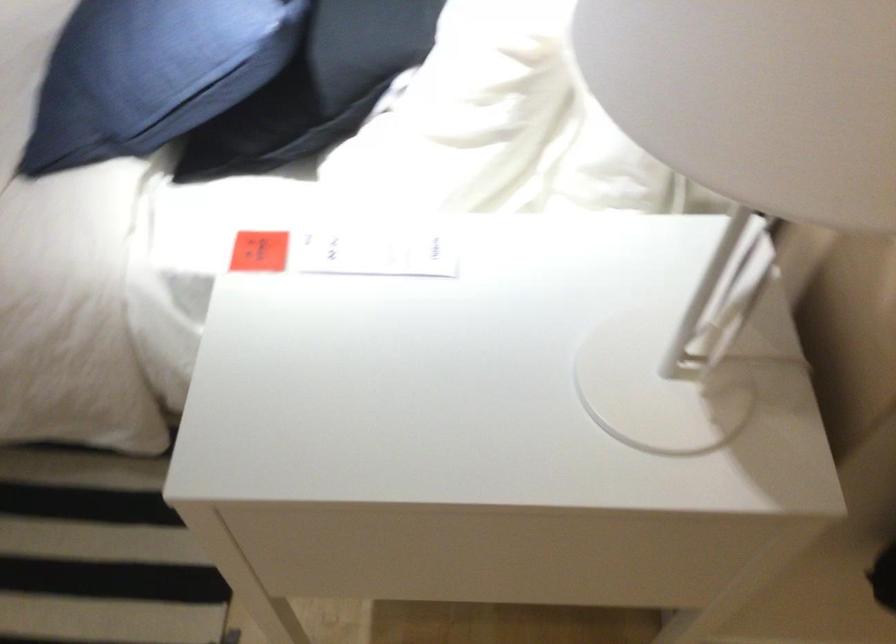
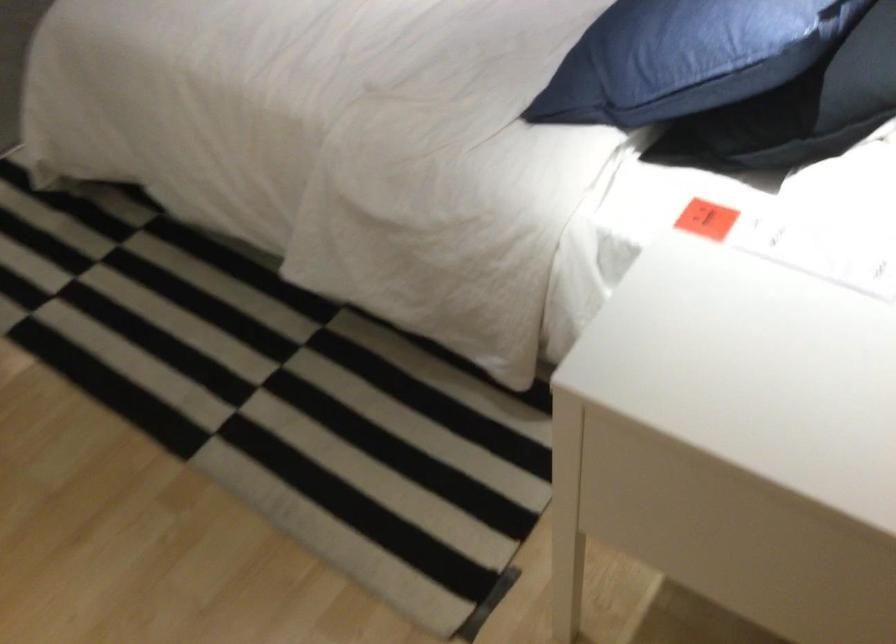
In the second image, find the point that corresponds to [164,77] in the first image.

(675, 58)